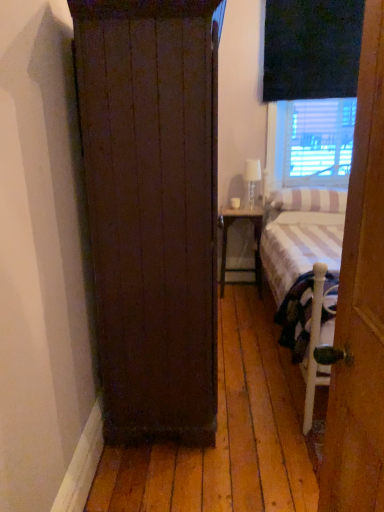
Question: From a real-world perspective, is wooden door at right located beneath clear glass lamp at upper right?

Choices:
 (A) no
 (B) yes

Answer: (B)

Question: Is wooden door at right looking in the opposite direction of clear glass lamp at upper right?

Choices:
 (A) yes
 (B) no

Answer: (B)

Question: Is wooden door at right at the right side of clear glass lamp at upper right?

Choices:
 (A) no
 (B) yes

Answer: (A)

Question: Can we say wooden door at right lies outside clear glass lamp at upper right?

Choices:
 (A) no
 (B) yes

Answer: (B)

Question: From the image's perspective, would you say wooden door at right is shown under clear glass lamp at upper right?

Choices:
 (A) no
 (B) yes

Answer: (B)

Question: In the image, is white striped pillow at right on the left side or the right side of wooden door at right?

Choices:
 (A) right
 (B) left

Answer: (A)

Question: Is point (306, 209) closer or farther from the camera than point (374, 315)?

Choices:
 (A) farther
 (B) closer

Answer: (A)

Question: From the image's perspective, relative to wooden door at right, is white striped pillow at right above or below?

Choices:
 (A) below
 (B) above

Answer: (B)

Question: In terms of height, does white striped pillow at right look taller or shorter compared to wooden door at right?

Choices:
 (A) short
 (B) tall

Answer: (A)

Question: Is clear glass lamp at upper right inside the boundaries of white striped pillow at right, or outside?

Choices:
 (A) inside
 (B) outside

Answer: (B)

Question: Based on their sizes in the image, would you say clear glass lamp at upper right is bigger or smaller than white striped pillow at right?

Choices:
 (A) big
 (B) small

Answer: (B)

Question: From the image's perspective, is clear glass lamp at upper right positioned above or below white striped pillow at right?

Choices:
 (A) above
 (B) below

Answer: (A)

Question: From a real-world perspective, is clear glass lamp at upper right above or below white striped pillow at right?

Choices:
 (A) above
 (B) below

Answer: (A)

Question: Considering the positions of matte white wood nightstand at center and white striped pillow at right in the image, is matte white wood nightstand at center wider or thinner than white striped pillow at right?

Choices:
 (A) thin
 (B) wide

Answer: (A)

Question: Is point (238, 270) positioned closer to the camera than point (342, 201)?

Choices:
 (A) closer
 (B) farther

Answer: (B)